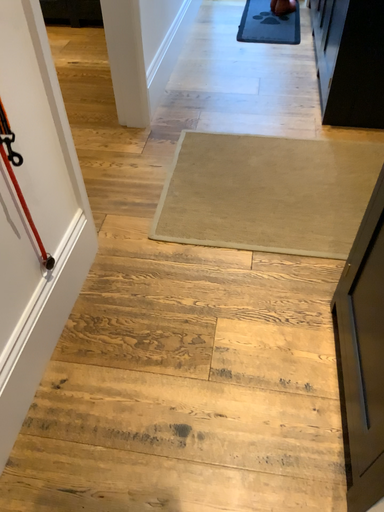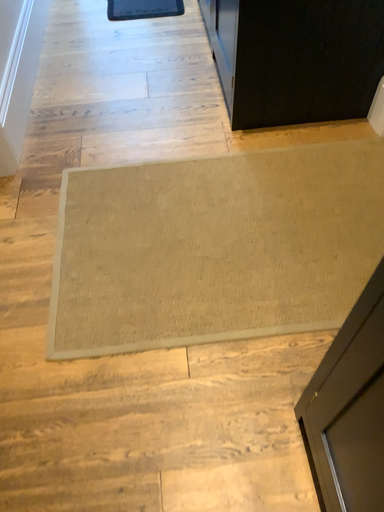
Question: How did the camera likely rotate when shooting the video?

Choices:
 (A) rotated right
 (B) rotated left

Answer: (A)